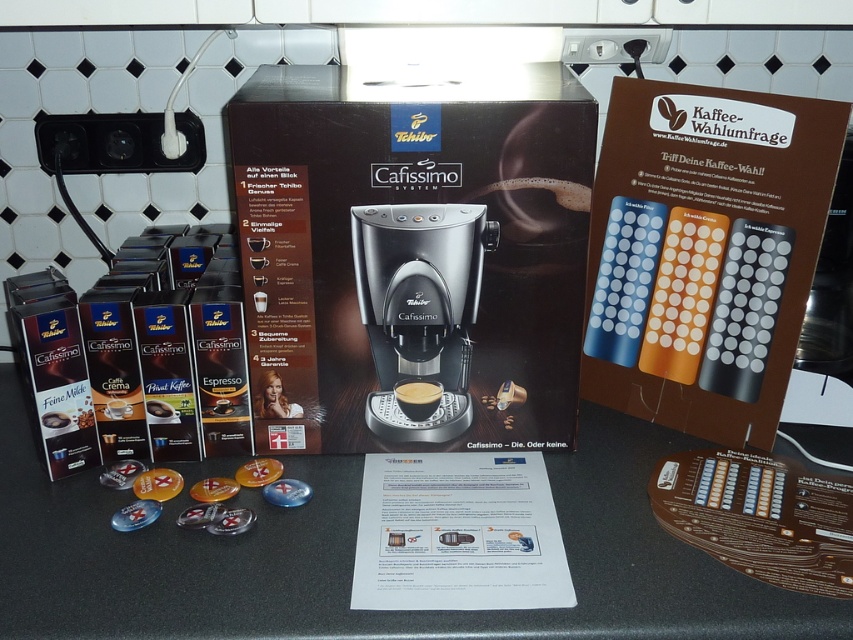
How far apart are black matte counter at center and black glossy coffee at center?

A distance of 10.66 inches exists between black matte counter at center and black glossy coffee at center.

Which is behind, point (325, 456) or point (430, 390)?

Point (325, 456)

Locate an element on the screen. The image size is (853, 640). black matte counter at center is located at coordinates click(352, 556).

Is black matte counter at center wider than black plastic coffee machine at center?

Indeed, black matte counter at center has a greater width compared to black plastic coffee machine at center.

Between black matte counter at center and black plastic coffee machine at center, which one is positioned lower?

black matte counter at center is below.

Describe the element at coordinates (352, 556) in the screenshot. I see `black matte counter at center` at that location.

Image resolution: width=853 pixels, height=640 pixels. What are the coordinates of `black matte counter at center` in the screenshot? It's located at (352, 556).

From the picture: Does black plastic coffee machine at center appear over black glossy coffee at center?

Yes, black plastic coffee machine at center is above black glossy coffee at center.

The height and width of the screenshot is (640, 853). What are the coordinates of `black plastic coffee machine at center` in the screenshot? It's located at (421, 310).

Who is more forward, (x=450, y=285) or (x=416, y=404)?

Point (x=450, y=285) is more forward.

The width and height of the screenshot is (853, 640). Identify the location of black plastic coffee machine at center. (421, 310).